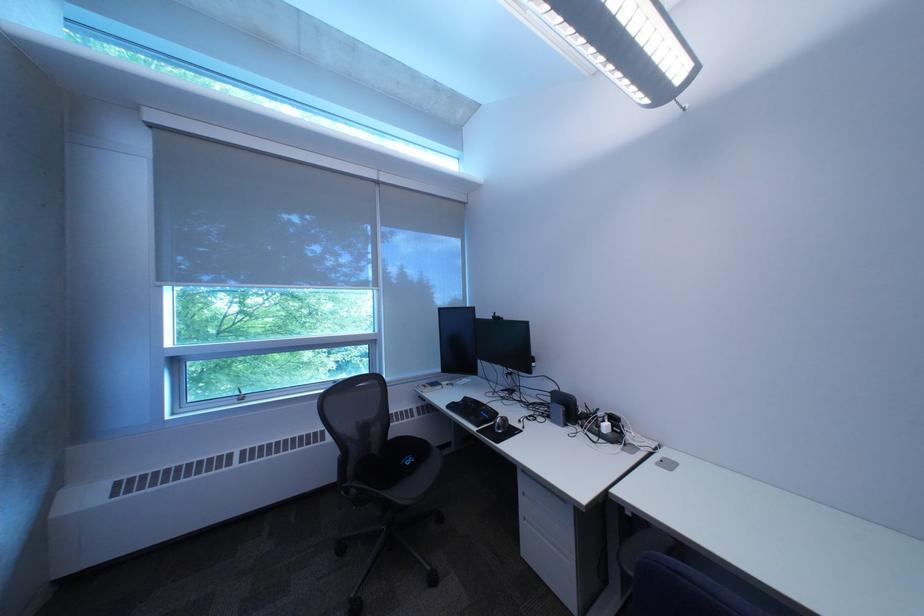
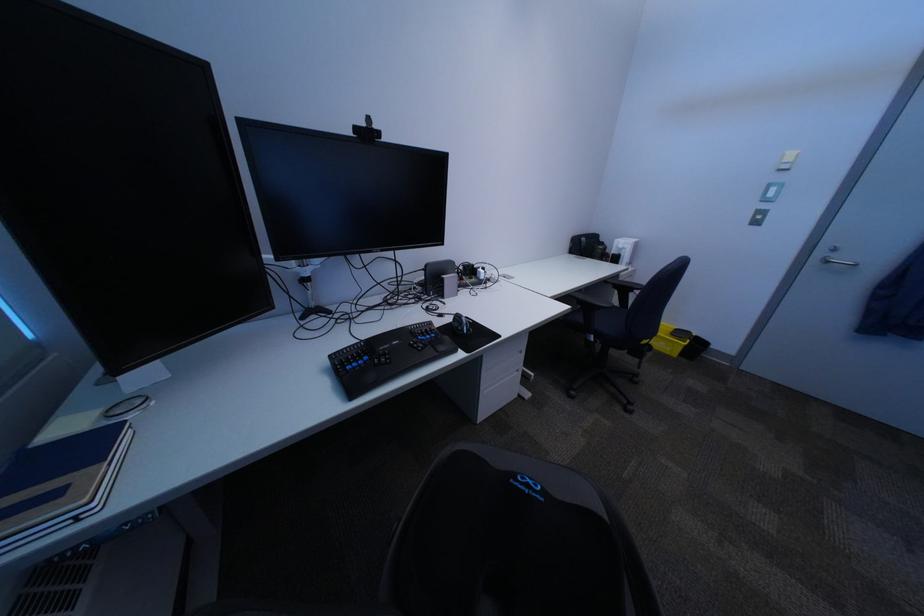
Locate, in the second image, the point that corresponds to (x=508, y=318) in the first image.

(371, 131)